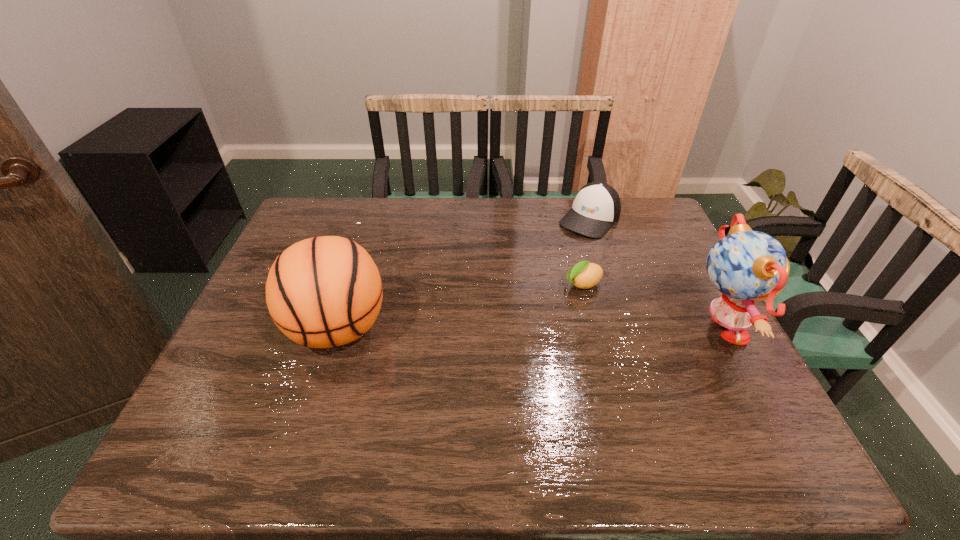
Identify the location of free spot on the desktop that is between the basketball and the rightmost object and is positioned with leaves positioned above the shortest object. (478, 330).

The image size is (960, 540). What are the coordinates of `vacant spot on the desktop that is between the leftmost object and the doll and is positioned on the front panel of the farthest object` in the screenshot? It's located at (487, 330).